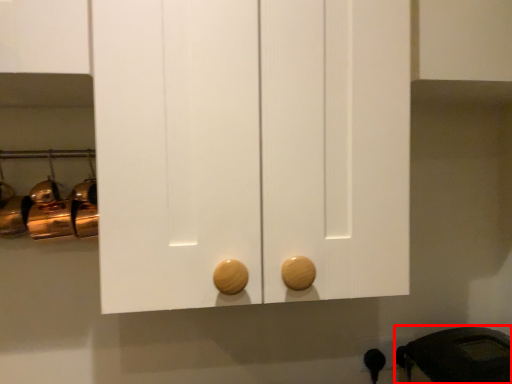
Question: From the image's perspective, considering the relative positions of appliance (annotated by the red box) and door handle in the image provided, where is appliance (annotated by the red box) located with respect to the staircase?

Choices:
 (A) above
 (B) below

Answer: (A)